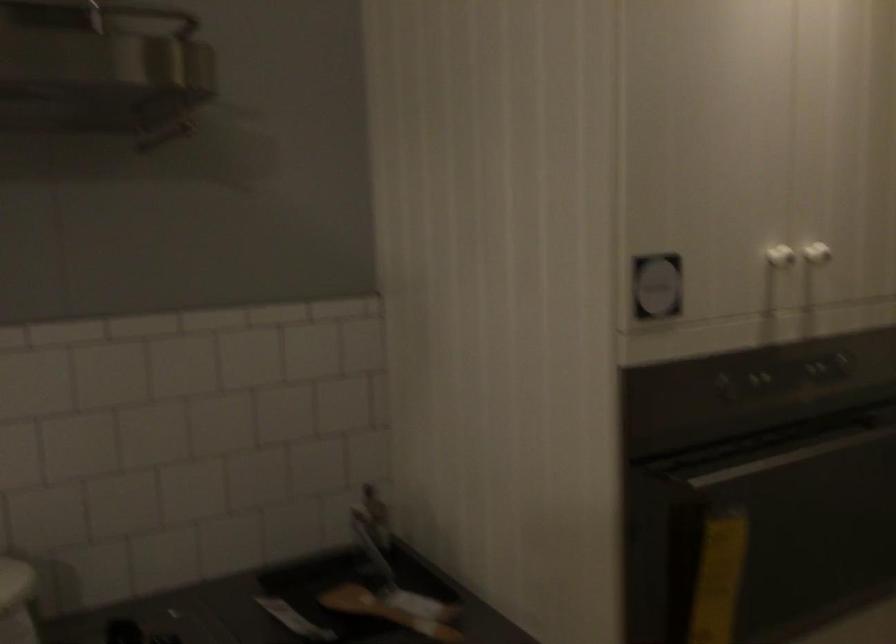
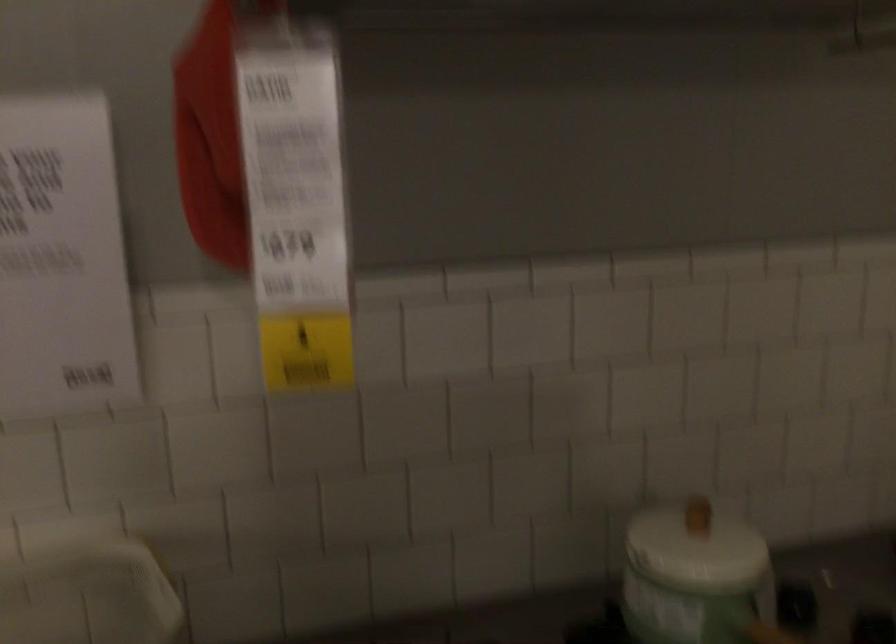
Question: The images are taken continuously from a first-person perspective. In which direction are you moving?

Choices:
 (A) Left
 (B) Right
 (C) Forward
 (D) Backward

Answer: (A)